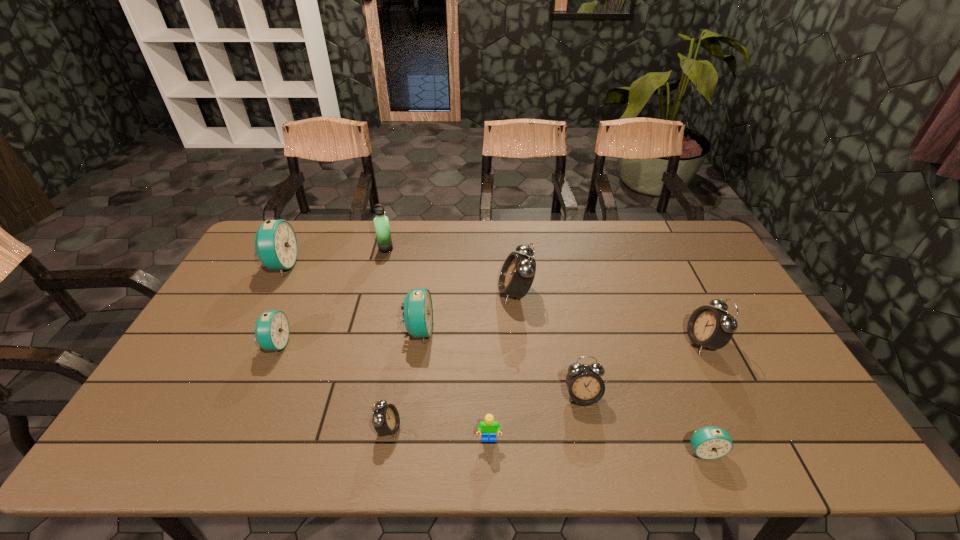
Where is `the third object from right to left`? the third object from right to left is located at coordinates (585, 385).

Image resolution: width=960 pixels, height=540 pixels. Identify the location of the third alarm clock from right to left. (585, 385).

At what (x,y) coordinates should I click in order to perform the action: click on the fifth object from right to left. Please return your answer as a coordinate pair (x, y). This screenshot has width=960, height=540. Looking at the image, I should click on (488, 426).

The image size is (960, 540). Find the location of `Lego`. Lego is located at coordinates (488, 426).

At what (x,y) coordinates should I click in order to perform the action: click on the nearest white alarm clock. Please return your answer as a coordinate pair (x, y). This screenshot has height=540, width=960. Looking at the image, I should click on (386, 420).

Where is `the smallest white alarm clock`? the smallest white alarm clock is located at coordinates (386, 420).

This screenshot has height=540, width=960. Identify the location of the ninth object from left to right. (711, 442).

Locate an element on the screen. Image resolution: width=960 pixels, height=540 pixels. the smallest blue alarm clock is located at coordinates (711, 442).

Locate an element on the screen. free space located 0.350m on the left of the thermos bottle is located at coordinates (281, 249).

Where is `vacant point located on the front-facing side of the farthest blue alarm clock`? The height and width of the screenshot is (540, 960). vacant point located on the front-facing side of the farthest blue alarm clock is located at coordinates (358, 265).